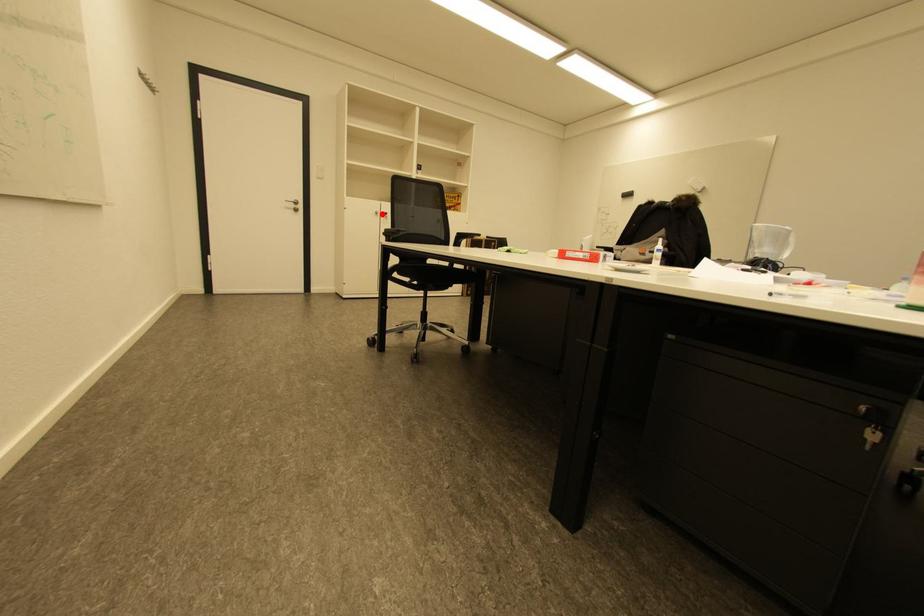
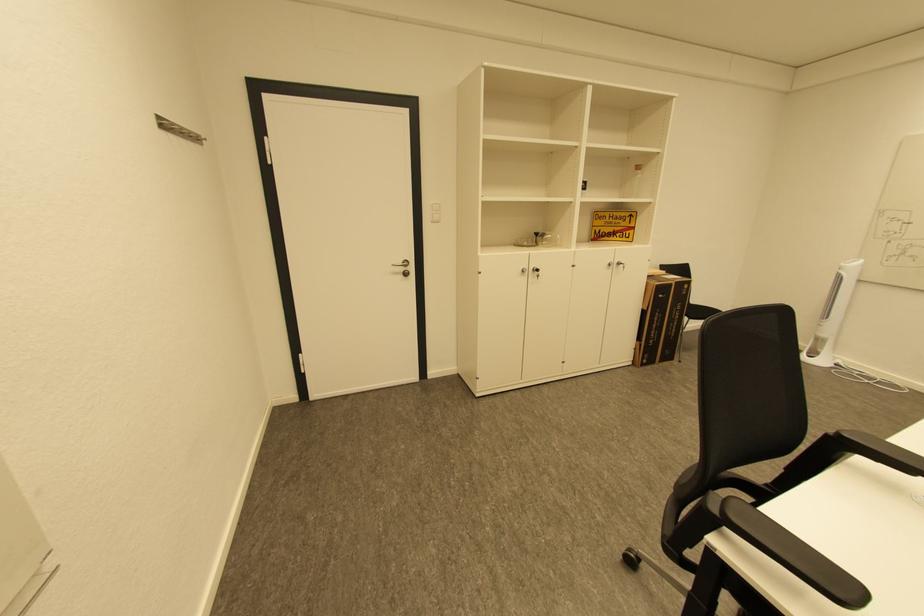
In the second image, find the point that corresponds to the highlighted location in the first image.

(529, 272)